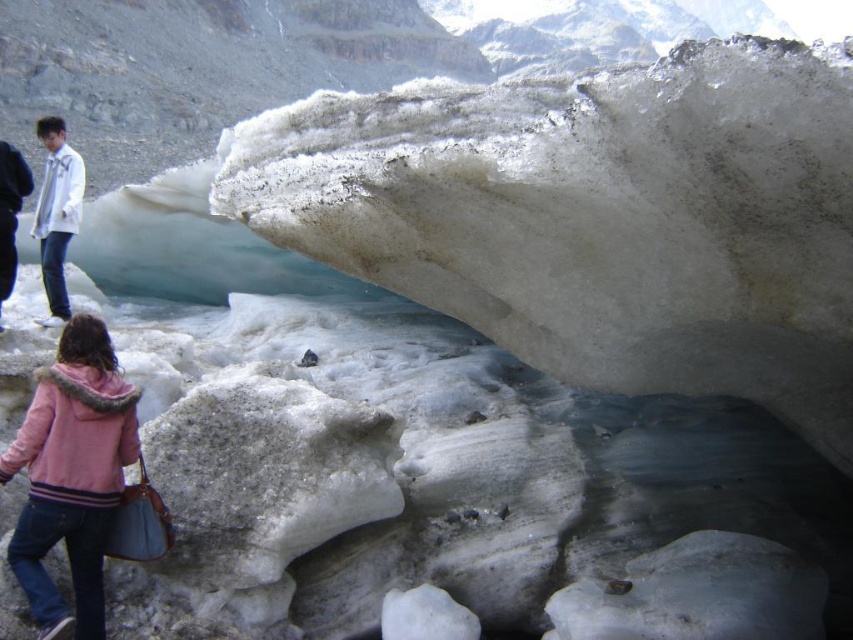
You are a hiker planning to walk from the pink fleece jacket at lower left to the translucent ice at center. Based on the scene, can you safely walk directly towards the ice from your current position?

The translucent ice at center is in front of the pink fleece jacket at lower left, so yes, you can safely walk directly towards the ice from your current position as there are no obstacles blocking the path between them.

You are planning to cross the translucent ice at center while carrying a heavy backpack. Considering the pink fleece jacket at lower left is nearby, can you estimate if the ice can support your weight?

The translucent ice at center is wider than the pink fleece jacket at lower left, but without knowing the exact weight capacity of the ice, it is impossible to determine if it can support your weight. Proceed with caution.